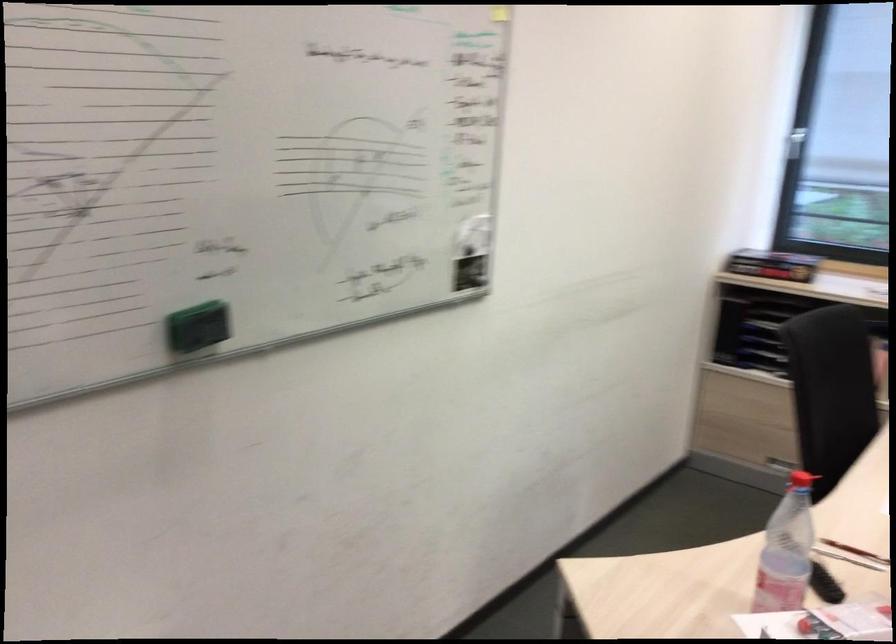
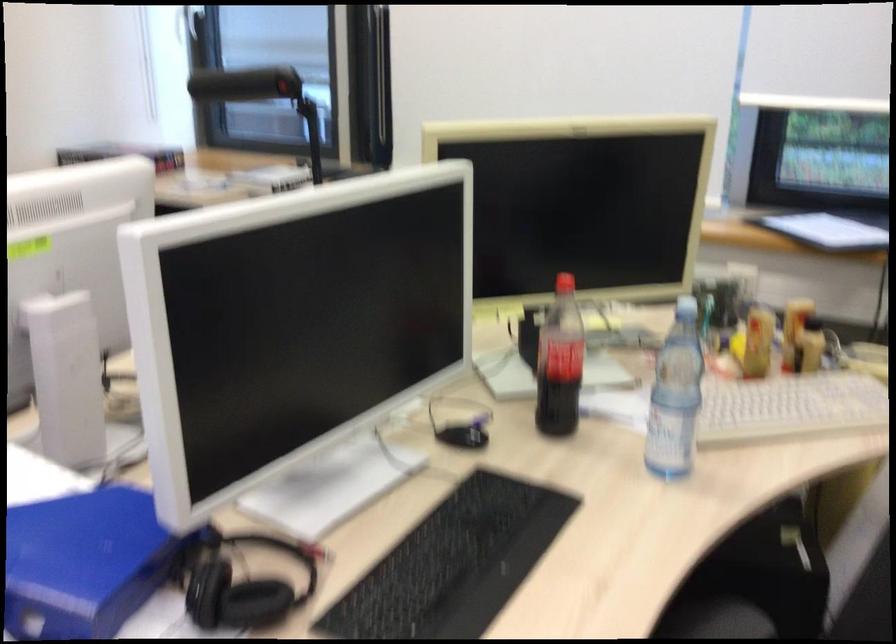
Question: Which direction would the cameraman need to move to produce the second image? Reply with the corresponding letter.

Choices:
 (A) Left
 (B) Right
 (C) Forward
 (D) Backward

Answer: (B)